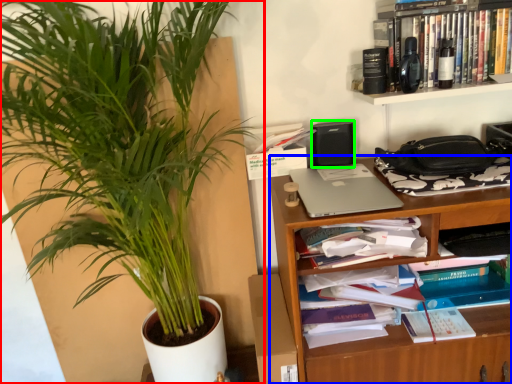
Question: Estimate the real-world distances between objects in this image. Which object is closer to houseplant (highlighted by a red box), shelf (highlighted by a blue box) or speaker (highlighted by a green box)?

Choices:
 (A) shelf
 (B) speaker

Answer: (A)